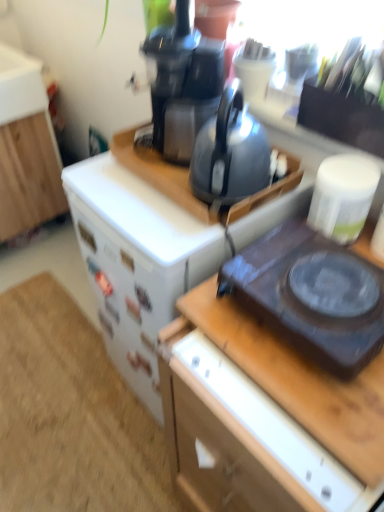
In order to click on empty space that is ontop of black plastic gas stove at right (from a real-world perspective) in this screenshot , I will do click(x=331, y=285).